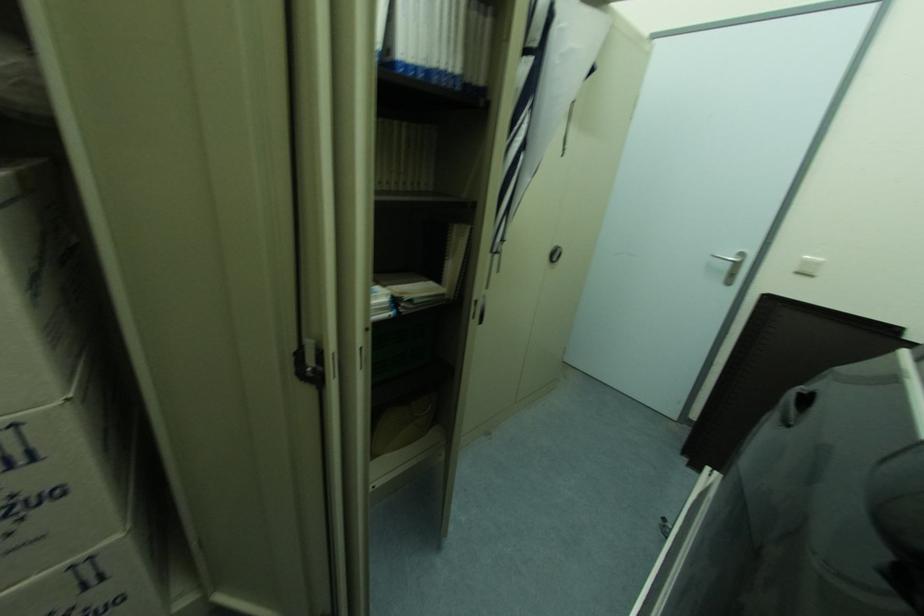
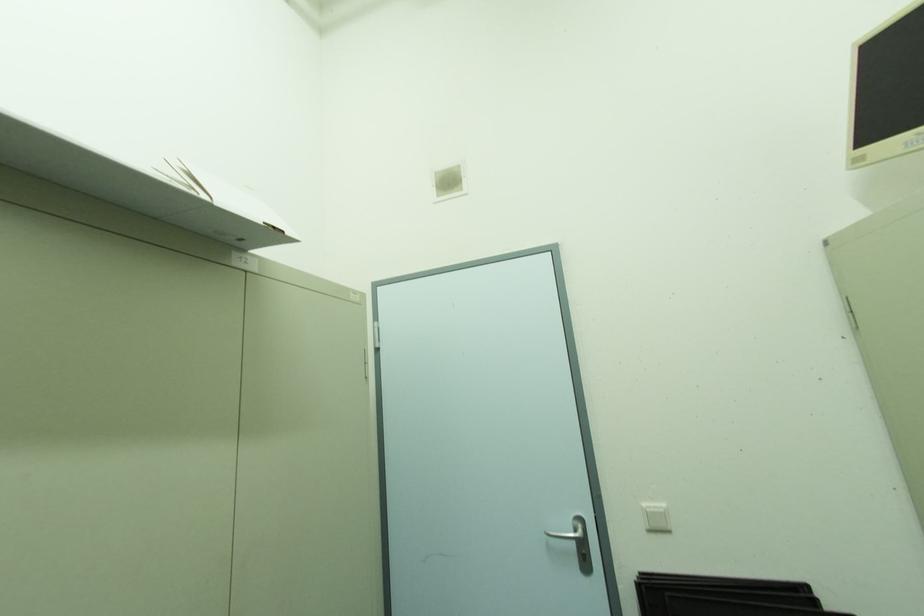
First-person continuous shooting, in which direction is the camera rotating?

The rotation direction of the camera is right-up.